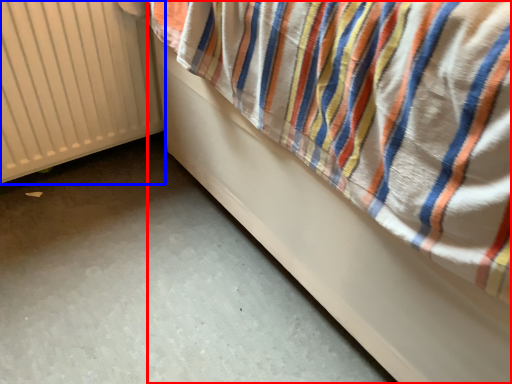
Question: Among these objects, which one is farthest to the camera, furniture (highlighted by a red box) or radiator (highlighted by a blue box)?

Choices:
 (A) furniture
 (B) radiator

Answer: (B)